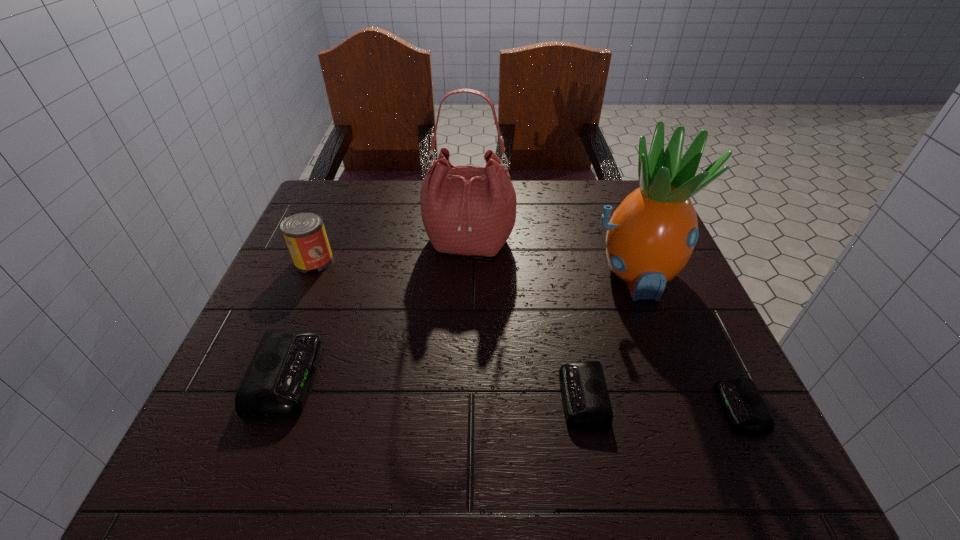
Find the location of a particular element. Image resolution: width=960 pixels, height=540 pixels. vacant region located 0.180m on the display of the third object from right to left is located at coordinates (457, 397).

I want to click on blank area located on the display of the third object from right to left, so click(x=398, y=397).

Where is `free region located 0.250m on the display of the third object from right to left`? The image size is (960, 540). free region located 0.250m on the display of the third object from right to left is located at coordinates (417, 397).

Find the location of a particular element. vacant space located 0.050m on the display of the shortest alarm clock is located at coordinates (693, 408).

I want to click on vacant space located 0.120m on the display of the shortest alarm clock, so click(x=651, y=408).

Where is `free region located 0.150m on the display of the shortest alarm clock`? This screenshot has width=960, height=540. free region located 0.150m on the display of the shortest alarm clock is located at coordinates (634, 408).

The image size is (960, 540). In order to click on vacant space positioned on the front of the handbag in this screenshot , I will do `click(467, 359)`.

The height and width of the screenshot is (540, 960). I want to click on vacant area situated at the entrance of the pineapple, so click(686, 411).

At what (x,y) coordinates should I click in order to perform the action: click on blank space located 0.340m on the front of the can. Please return your answer as a coordinate pair (x, y). Looking at the image, I should click on (252, 409).

Locate an element on the screen. object located in the far edge section of the desktop is located at coordinates (467, 210).